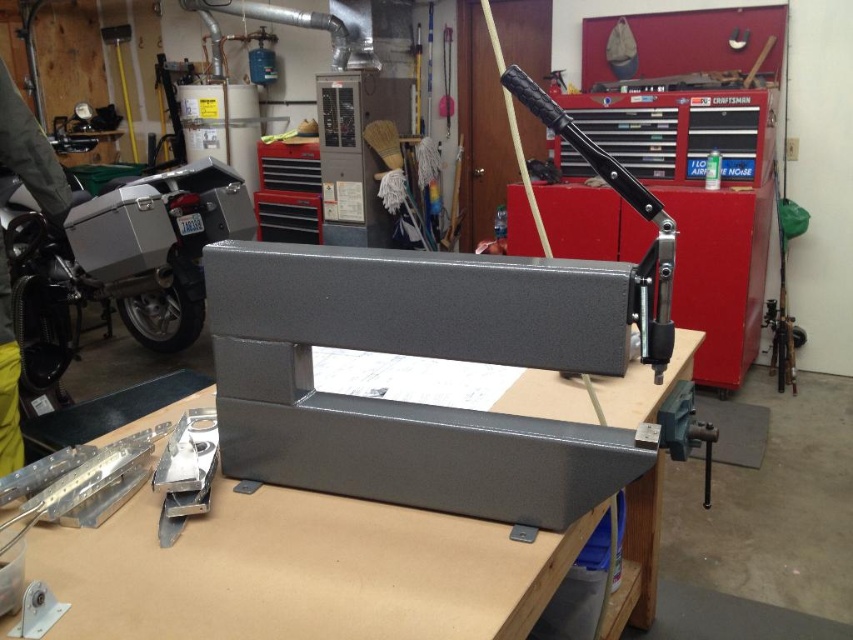
Can you confirm if brushed metal motorcycle at left is smaller than matte black handle at upper center?

No.

Is brushed metal motorcycle at left wider than matte black handle at upper center?

Correct, the width of brushed metal motorcycle at left exceeds that of matte black handle at upper center.

Which is behind, point (57, 316) or point (621, 180)?

Positioned behind is point (57, 316).

Image resolution: width=853 pixels, height=640 pixels. What are the coordinates of `brushed metal motorcycle at left` in the screenshot? It's located at (122, 259).